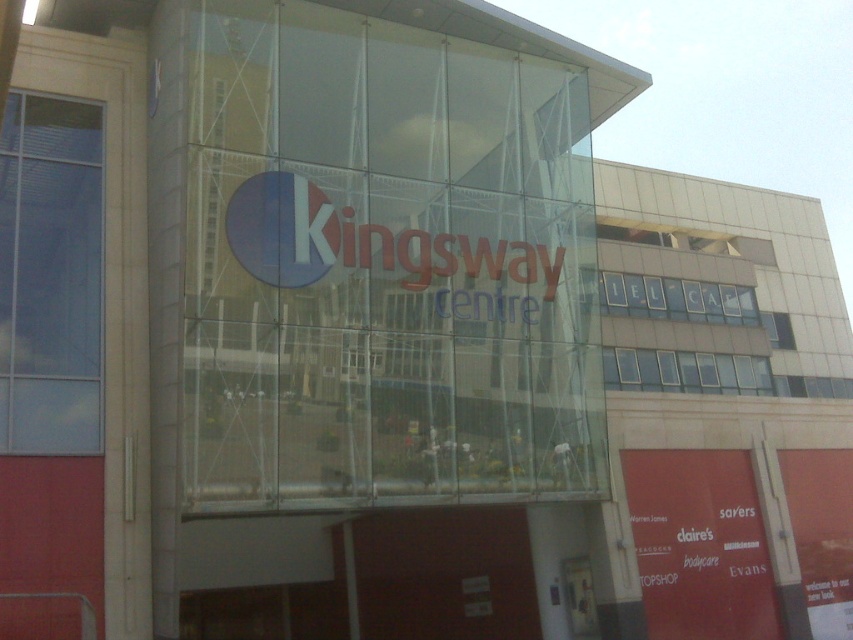
In the scene shown: Who is more forward, [564,260] or [735,566]?

Point [564,260]

Does transparent glass kingsway centre sign at center appear over matte red sign at lower right?

Yes, transparent glass kingsway centre sign at center is above matte red sign at lower right.

Who is more distant from viewer, (x=334, y=163) or (x=637, y=554)?

The point (x=637, y=554) is behind.

I want to click on transparent glass kingsway centre sign at center, so click(x=384, y=266).